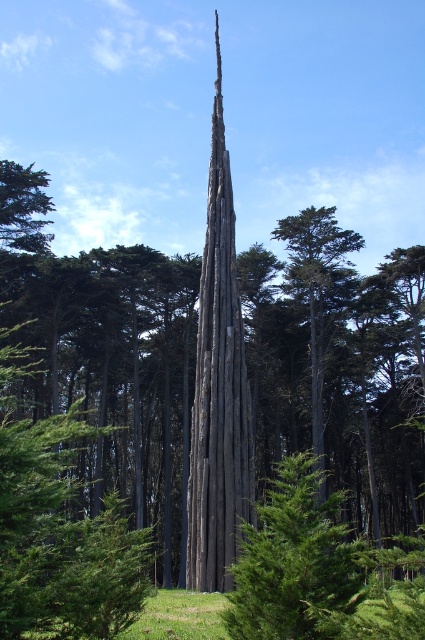
The width and height of the screenshot is (425, 640). I want to click on dark gray wood at center, so click(x=339, y=365).

Does dark gray wood at center have a greater height compared to dark gray wood tower at center?

No, dark gray wood at center is not taller than dark gray wood tower at center.

Between point (186, 358) and point (232, 225), which one is positioned in front?

Point (232, 225)

The height and width of the screenshot is (640, 425). Find the location of `dark gray wood at center`. dark gray wood at center is located at coordinates (339, 365).